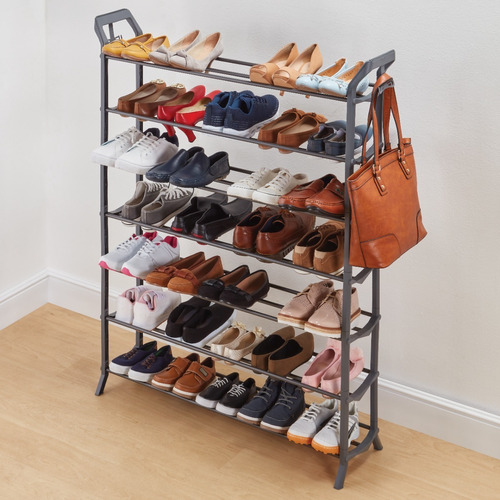
I want to click on shoes on shelf above bottom shelf, so click(125, 308), click(144, 320), click(172, 321), click(190, 332), click(213, 342), click(228, 349), click(257, 354), click(276, 362), click(309, 377), click(328, 383).